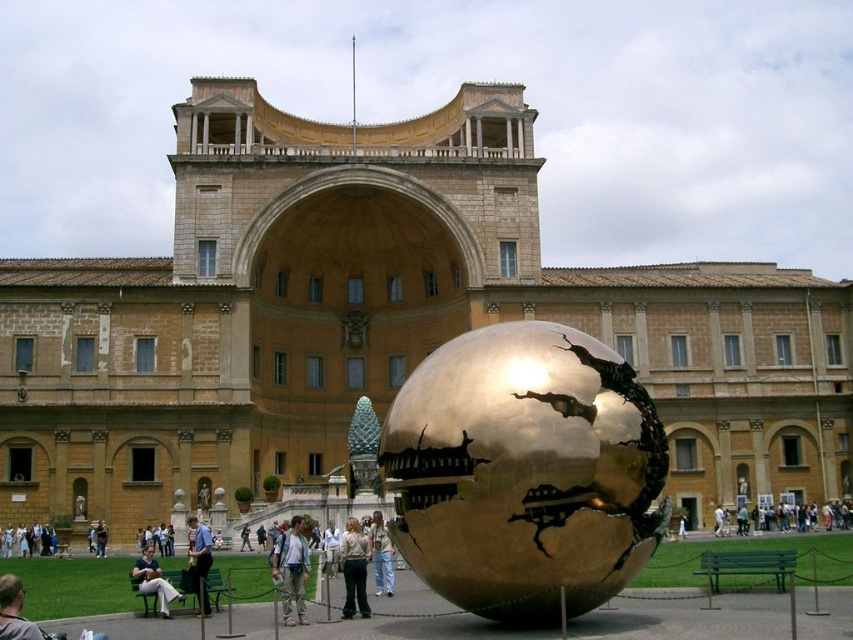
Measure the distance between khaki cotton pants at center and light brown leather jacket at lower left.

47.33 feet

Is khaki cotton pants at center positioned before light brown leather jacket at lower left?

No, khaki cotton pants at center is further to the viewer.

The image size is (853, 640). Identify the location of khaki cotton pants at center. (354, 570).

Is light blue denim jeans at center in front of light beige pants at lower left?

Yes, it is in front of light beige pants at lower left.

Is point (207, 529) positioned before point (180, 595)?

That is False.

Does point (206, 616) lie in front of point (144, 593)?

No, (206, 616) is further to viewer.

Find the location of a particular element. light blue denim jeans at center is located at coordinates (199, 561).

Does khaki cotton pants at center come behind light blue denim jeans at lower left?

No.

Which is more to the left, khaki cotton pants at center or light blue denim jeans at lower left?

From the viewer's perspective, light blue denim jeans at lower left appears more on the left side.

Is point (352, 547) behind point (28, 532)?

No, (352, 547) is closer to viewer.

Where is `khaki cotton pants at center`? Image resolution: width=853 pixels, height=640 pixels. khaki cotton pants at center is located at coordinates (x=354, y=570).